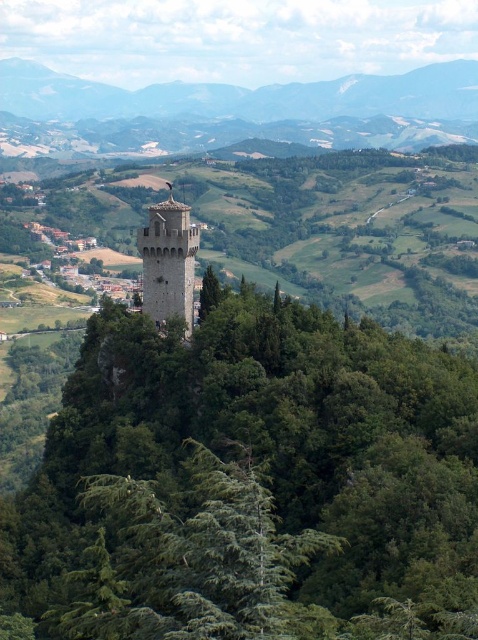
Question: Can you confirm if green leafy tree at center is positioned to the left of stone tower at center?

Choices:
 (A) no
 (B) yes

Answer: (A)

Question: Based on their relative distances, which object is nearer to the stone tower at center?

Choices:
 (A) green leafy tree at center
 (B) smooth gray mountain at upper center

Answer: (A)

Question: Which object is farther from the camera taking this photo?

Choices:
 (A) stone tower at center
 (B) green leafy tree at center
 (C) smooth gray mountain at upper center

Answer: (C)

Question: Observing the image, what is the correct spatial positioning of smooth gray mountain at upper center in reference to stone tower at center?

Choices:
 (A) right
 (B) left

Answer: (A)

Question: Which is nearer to the green leafy tree at center?

Choices:
 (A) smooth gray mountain at upper center
 (B) stone tower at center

Answer: (B)

Question: Can you confirm if green leafy tree at center is smaller than smooth gray mountain at upper center?

Choices:
 (A) yes
 (B) no

Answer: (A)